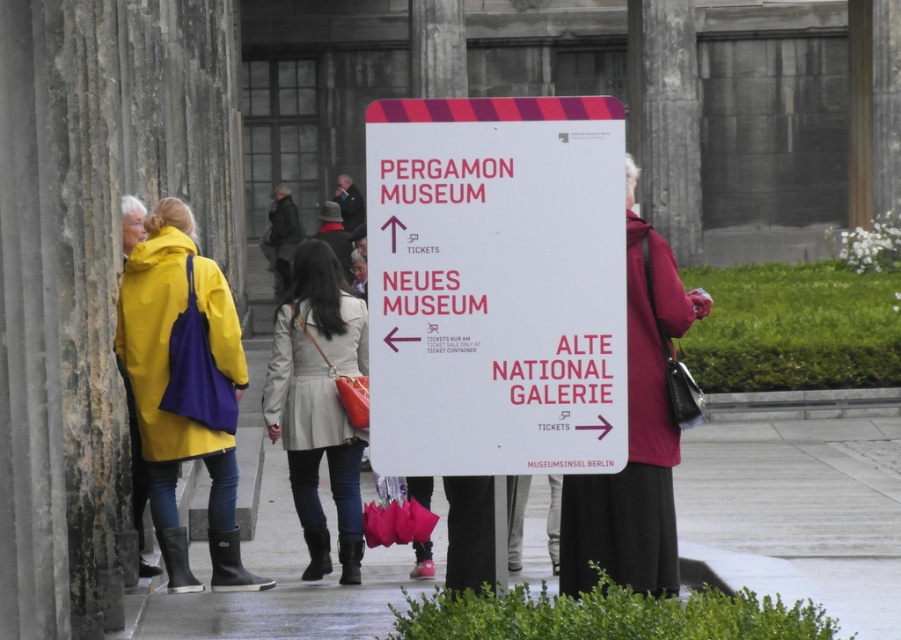
Question: From the image, what is the correct spatial relationship of yellow matte coat at left in relation to light beige leather coat at center?

Choices:
 (A) above
 (B) below

Answer: (A)

Question: Which point is farther to the camera?

Choices:
 (A) (308, 452)
 (B) (671, 497)
 (C) (224, 461)
 (D) (432, 380)

Answer: (A)

Question: Which point is closer to the camera?

Choices:
 (A) (498, 141)
 (B) (292, 438)
 (C) (629, 465)
 (D) (170, 404)

Answer: (A)

Question: Which point is farther to the camera?

Choices:
 (A) matte pink coat at center
 (B) yellow matte coat at left

Answer: (B)

Question: Is yellow matte coat at left above light beige leather coat at center?

Choices:
 (A) no
 (B) yes

Answer: (B)

Question: Can you confirm if yellow matte coat at left is thinner than matte pink coat at center?

Choices:
 (A) yes
 (B) no

Answer: (B)